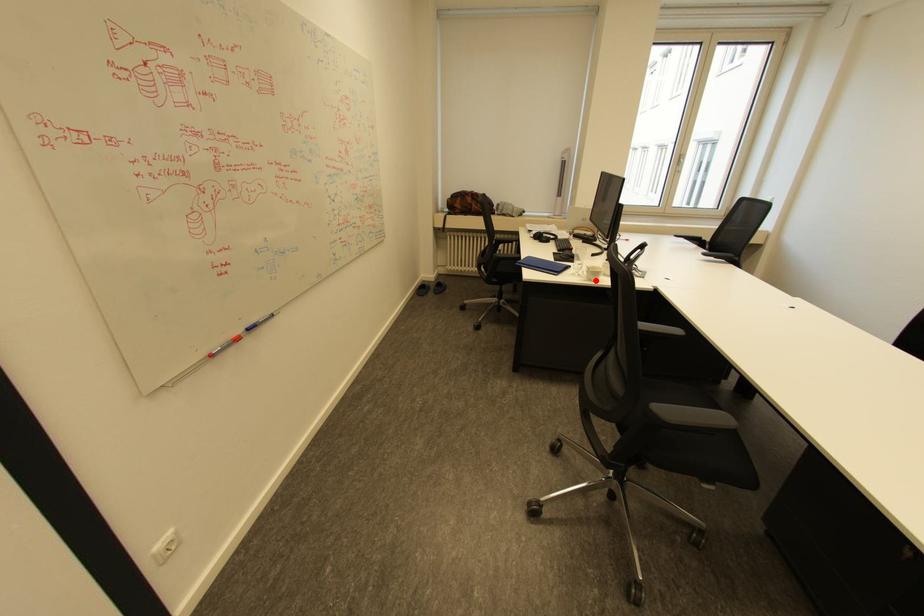
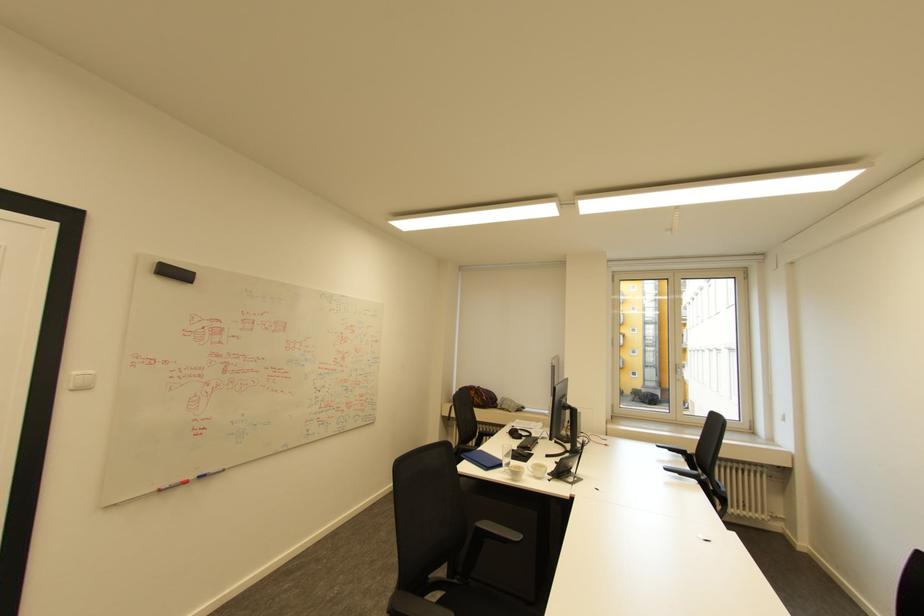
The point at the highlighted location is marked in the first image. Where is the corresponding point in the second image?

(518, 479)